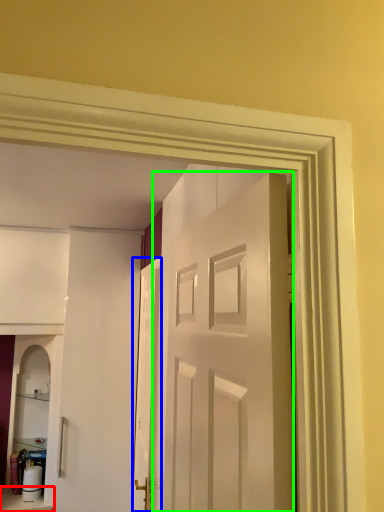
Question: Which object is the closest to the furniture (highlighted by a red box)? Choose among these: door (highlighted by a blue box) or door (highlighted by a green box).

Choices:
 (A) door
 (B) door

Answer: (A)